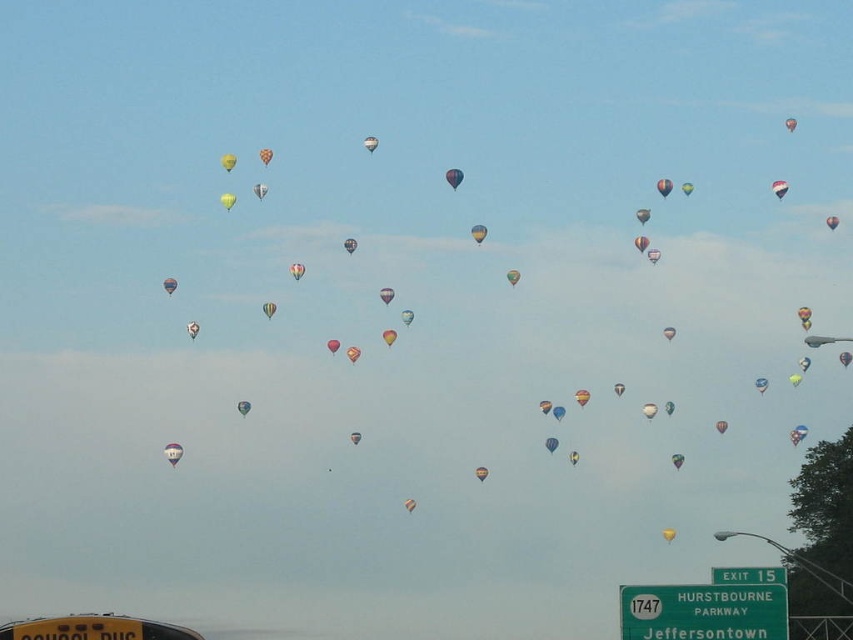
You are a pilot trying to navigate between the matte blue balloon at center and the yellow fabric balloon at upper center. Which balloon should you fly under to avoid collision?

You should fly under the yellow fabric balloon at upper center because the matte blue balloon at center is shorter in height than the yellow fabric balloon at upper center.

You are standing on the observation deck of a skyscraper and looking at the scene. There is a point marked at coordinates (x=453, y=177). What object is located at that point?

A: The point at coordinates (x=453, y=177) is occupied by a matte blue balloon at center.

You are an air traffic controller observing the scene. The matte blue balloon at center is at coordinates 0.278, 0.532. If another balloon appears at coordinates 0.3, 0.5, which balloon is closer to the center of the sky? Please answer based on their coordinates.

The matte blue balloon at center is closer to the center of the sky because its coordinates are closer to the center point of the image.